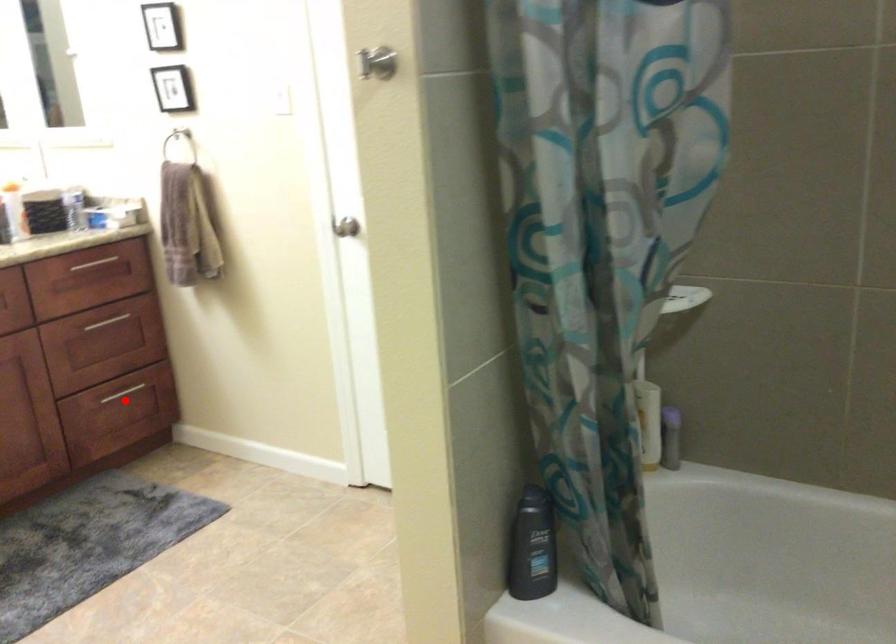
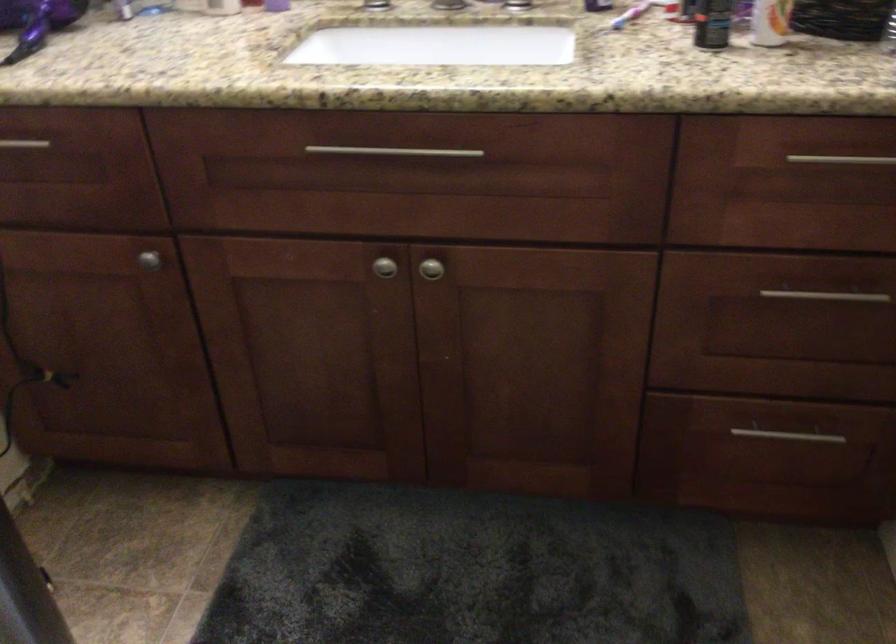
Locate, in the second image, the point that corresponds to the highlighted location in the first image.

(778, 446)